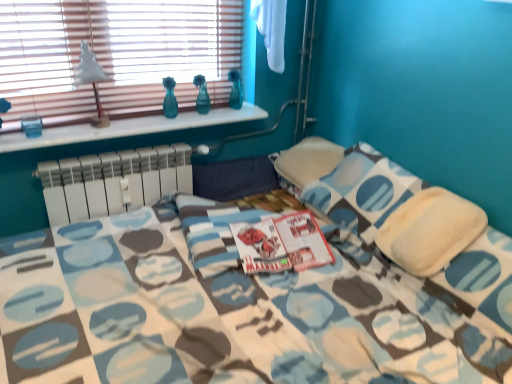
Question: Does white marble window sill at upper left have a lesser height compared to white matte table lamp at upper left?

Choices:
 (A) no
 (B) yes

Answer: (B)

Question: Considering the relative sizes of white marble window sill at upper left and white matte table lamp at upper left in the image provided, is white marble window sill at upper left taller than white matte table lamp at upper left?

Choices:
 (A) yes
 (B) no

Answer: (B)

Question: Could you tell me if white marble window sill at upper left is facing white matte table lamp at upper left?

Choices:
 (A) no
 (B) yes

Answer: (A)

Question: Would you say white marble window sill at upper left is a long distance from white matte table lamp at upper left?

Choices:
 (A) yes
 (B) no

Answer: (B)

Question: Is white marble window sill at upper left bigger than white matte table lamp at upper left?

Choices:
 (A) yes
 (B) no

Answer: (A)

Question: Does point (76, 139) appear closer or farther from the camera than point (152, 170)?

Choices:
 (A) farther
 (B) closer

Answer: (B)

Question: Is white marble window sill at upper left to the left or to the right of white plastic radiator at center in the image?

Choices:
 (A) right
 (B) left

Answer: (A)

Question: From the image's perspective, is white marble window sill at upper left positioned above or below white plastic radiator at center?

Choices:
 (A) above
 (B) below

Answer: (A)

Question: Looking at their shapes, would you say white marble window sill at upper left is wider or thinner than white plastic radiator at center?

Choices:
 (A) wide
 (B) thin

Answer: (A)

Question: From the image's perspective, is white matte table lamp at upper left positioned above or below soft white pillow at center?

Choices:
 (A) above
 (B) below

Answer: (A)

Question: Looking at their shapes, would you say white matte table lamp at upper left is wider or thinner than soft white pillow at center?

Choices:
 (A) wide
 (B) thin

Answer: (B)

Question: Considering the positions of white matte table lamp at upper left and soft white pillow at center in the image, is white matte table lamp at upper left taller or shorter than soft white pillow at center?

Choices:
 (A) tall
 (B) short

Answer: (B)

Question: Would you say white matte table lamp at upper left is inside or outside soft white pillow at center?

Choices:
 (A) inside
 (B) outside

Answer: (B)

Question: Relative to white marble window sill at upper left, is wooden blinds at upper left in front or behind?

Choices:
 (A) behind
 (B) front

Answer: (B)

Question: Is wooden blinds at upper left bigger or smaller than white marble window sill at upper left?

Choices:
 (A) small
 (B) big

Answer: (B)